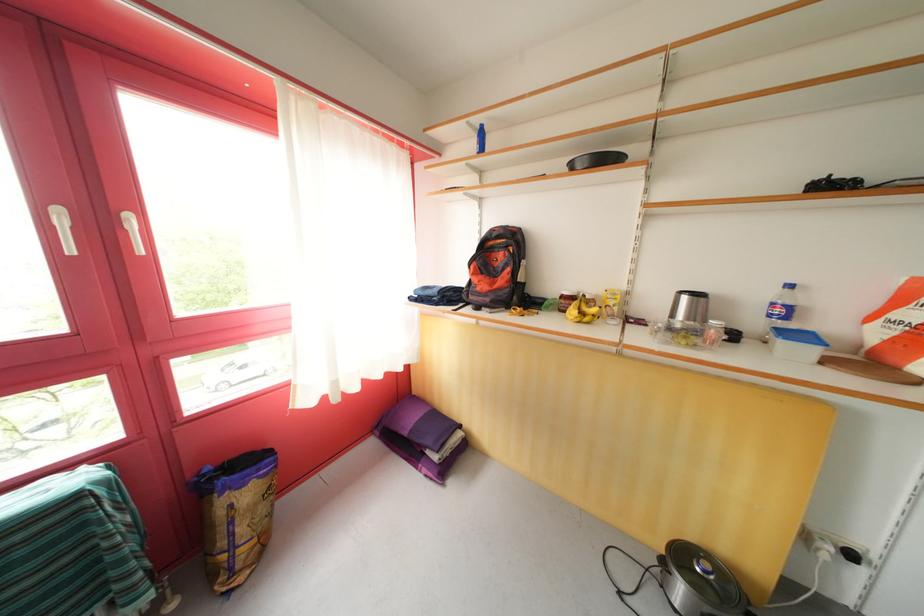
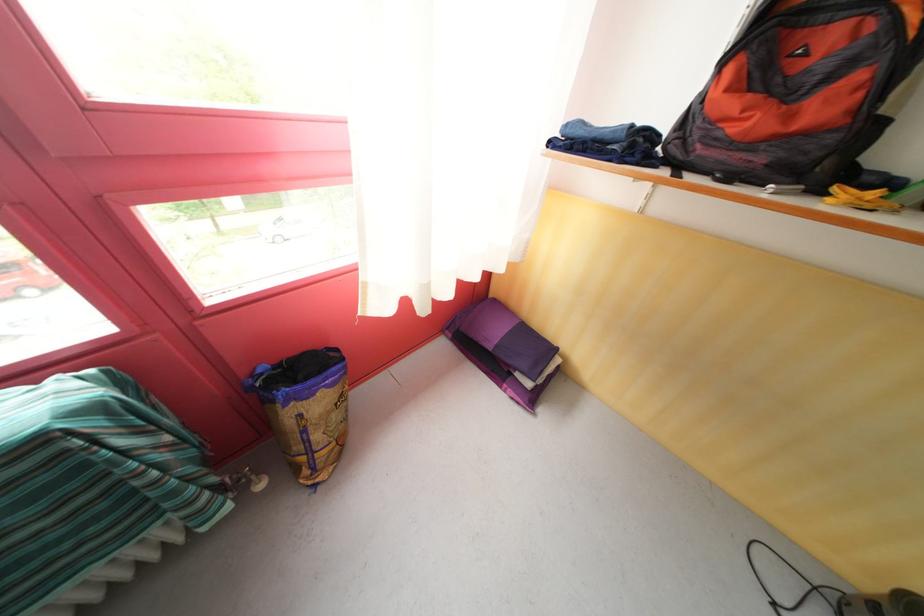
In the second image, find the point that corresponds to point (229, 549) in the first image.

(305, 454)